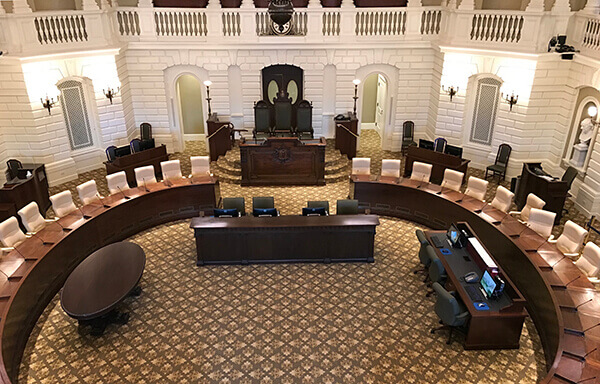
Image resolution: width=600 pixels, height=384 pixels. In order to click on face statue in this screenshot , I will do `click(584, 134)`.